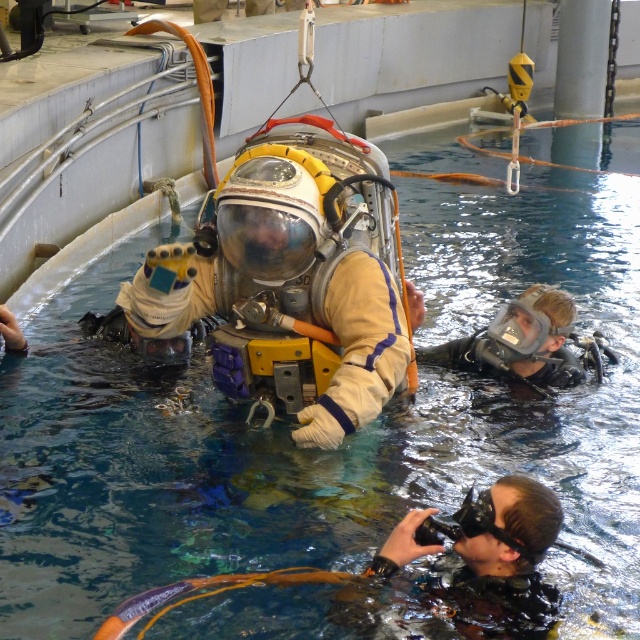
Does black rubber camera at lower right have a smaller size compared to clear plastic mask at lower right?

Yes.

Is black rubber camera at lower right taller than clear plastic mask at lower right?

Incorrect, black rubber camera at lower right's height is not larger of clear plastic mask at lower right's.

Does point (508, 522) lie behind point (442, 365)?

No, (508, 522) is in front of (442, 365).

The height and width of the screenshot is (640, 640). Find the location of `black rubber camera at lower right`. black rubber camera at lower right is located at coordinates (484, 560).